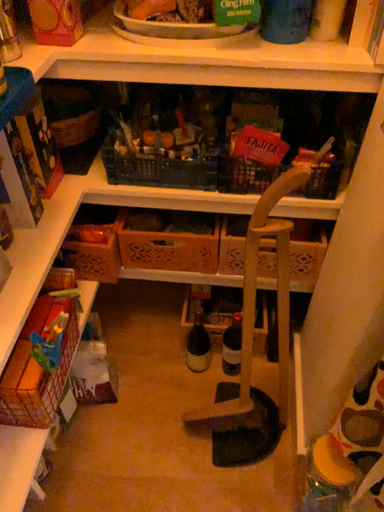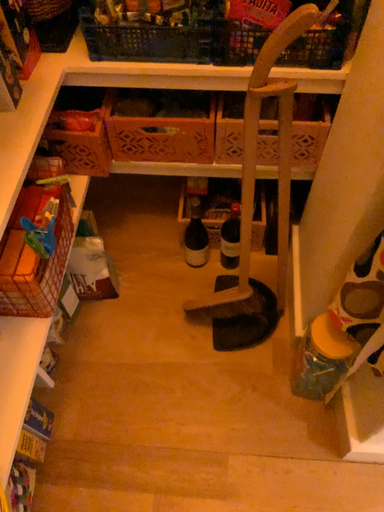
Question: Which way did the camera rotate in the video?

Choices:
 (A) rotated downward
 (B) rotated upward

Answer: (A)